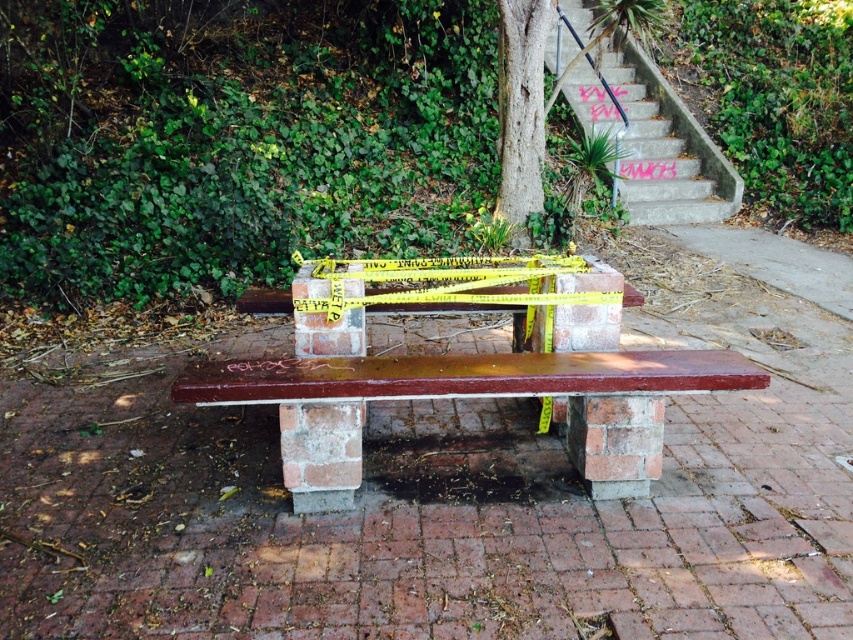
Between matte brown bench at center and smooth bark tree at center, which one is positioned higher?

smooth bark tree at center is above.

Is point (563, 314) positioned after point (521, 29)?

No, (563, 314) is closer to viewer.

You are a GUI agent. You are given a task and a screenshot of the screen. Output one action in this format:
    pyautogui.click(x=<x>, y=<y>)
    Task: Click on the matte brown bench at center
    
    Given the screenshot: What is the action you would take?
    pyautogui.click(x=465, y=369)

Does brick pavement at center have a greater height compared to smooth bark tree at center?

Incorrect, brick pavement at center's height is not larger of smooth bark tree at center's.

Is brick pavement at center below smooth bark tree at center?

Yes.

Is point (397, 481) farther from viewer compared to point (514, 173)?

No, it is not.

The image size is (853, 640). Identify the location of brick pavement at center. (434, 493).

Which of these two, concrete stairs at upper right or smooth bark tree at center, stands taller?

concrete stairs at upper right is taller.

Can you confirm if concrete stairs at upper right is smaller than smooth bark tree at center?

No, concrete stairs at upper right is not smaller than smooth bark tree at center.

Between point (663, 108) and point (543, 208), which one is positioned behind?

The point (663, 108) is more distant.

I want to click on concrete stairs at upper right, so point(665,148).